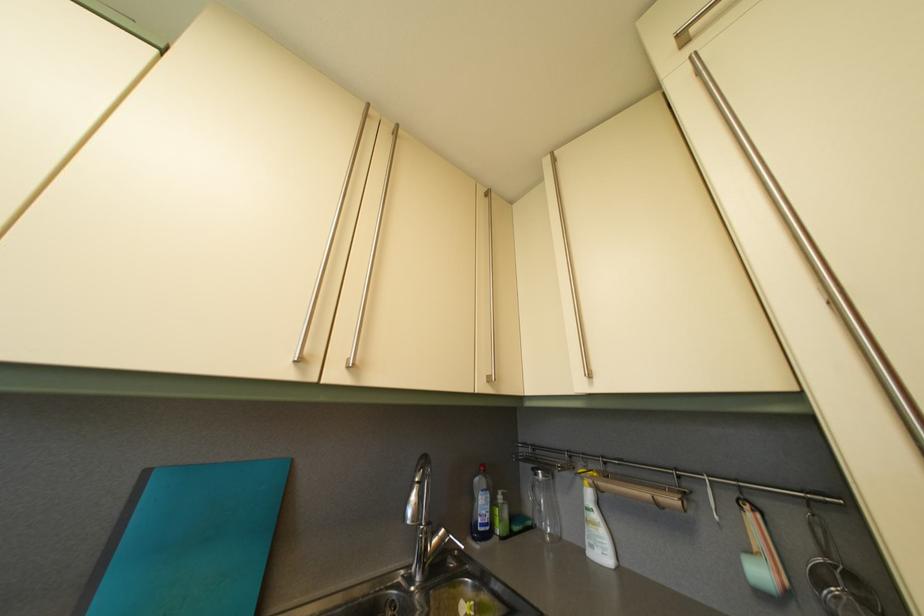
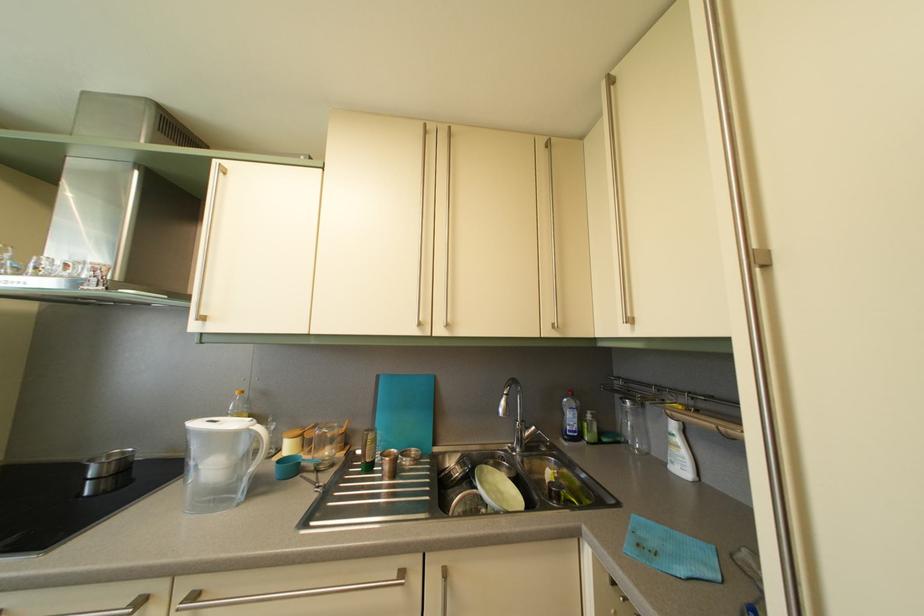
Find the pixel in the second image that matches pixel 435 531 in the first image.

(530, 429)